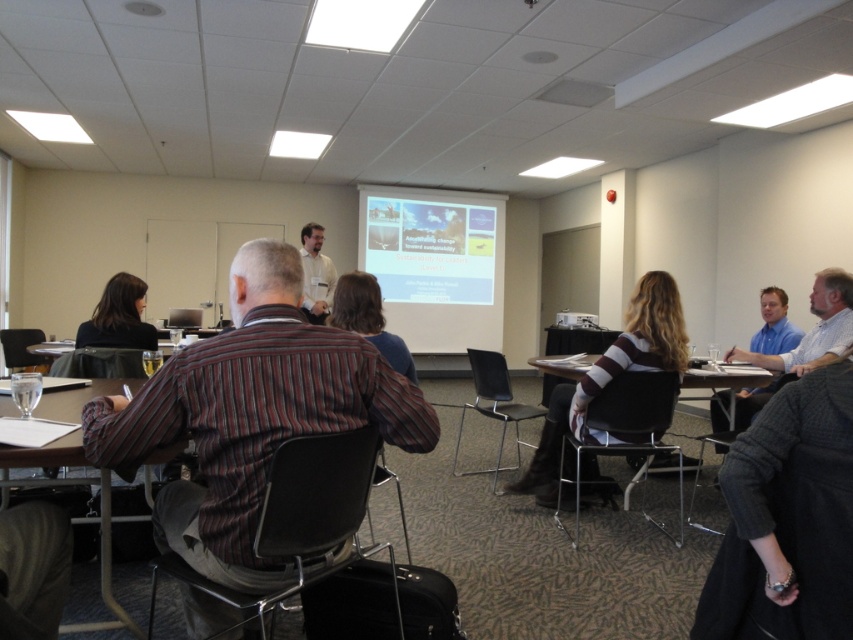
Measure the distance between white glossy projector screen at center and camera.

white glossy projector screen at center is 9.02 meters away from camera.

Which of these two, white glossy projector screen at center or black hair at left, stands taller?

Standing taller between the two is white glossy projector screen at center.

Does point (485, 292) lie behind point (131, 328)?

Yes, it is.

Where is `white glossy projector screen at center`? white glossy projector screen at center is located at coordinates (434, 264).

Is striped cotton shirt at center to the left of striped sweater at center from the viewer's perspective?

Yes, striped cotton shirt at center is to the left of striped sweater at center.

From the picture: Between striped cotton shirt at center and striped sweater at center, which one is positioned lower?

striped cotton shirt at center is below.

Who is more distant from viewer, (132, 403) or (633, 291)?

Point (633, 291)

Where is `striped cotton shirt at center`? striped cotton shirt at center is located at coordinates (251, 413).

Does wooden table at lower left have a lesser width compared to white plastic projector at center?

Incorrect, wooden table at lower left's width is not less than white plastic projector at center's.

Where is `wooden table at lower left`? The image size is (853, 640). wooden table at lower left is located at coordinates (106, 572).

Where is `wooden table at lower left`? The width and height of the screenshot is (853, 640). wooden table at lower left is located at coordinates (106, 572).